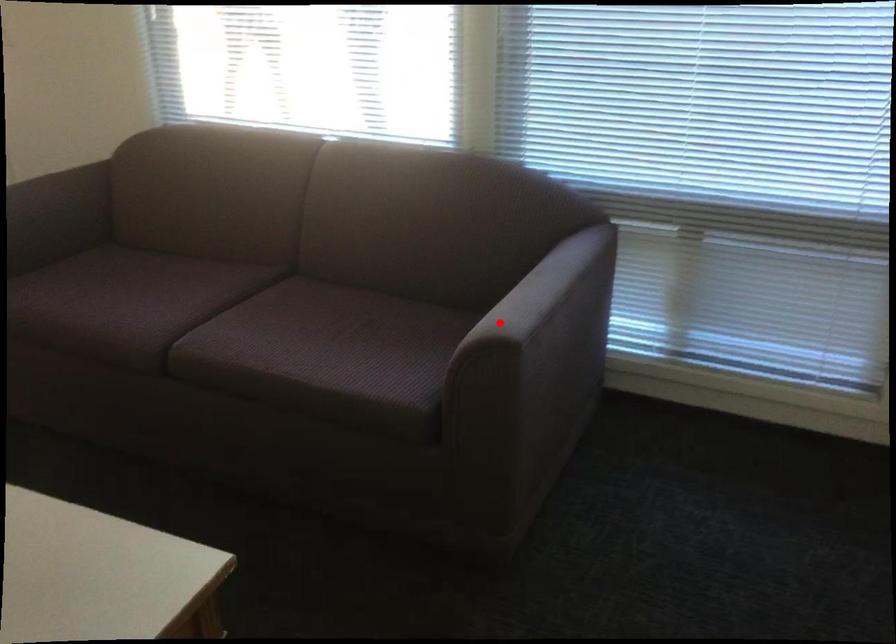
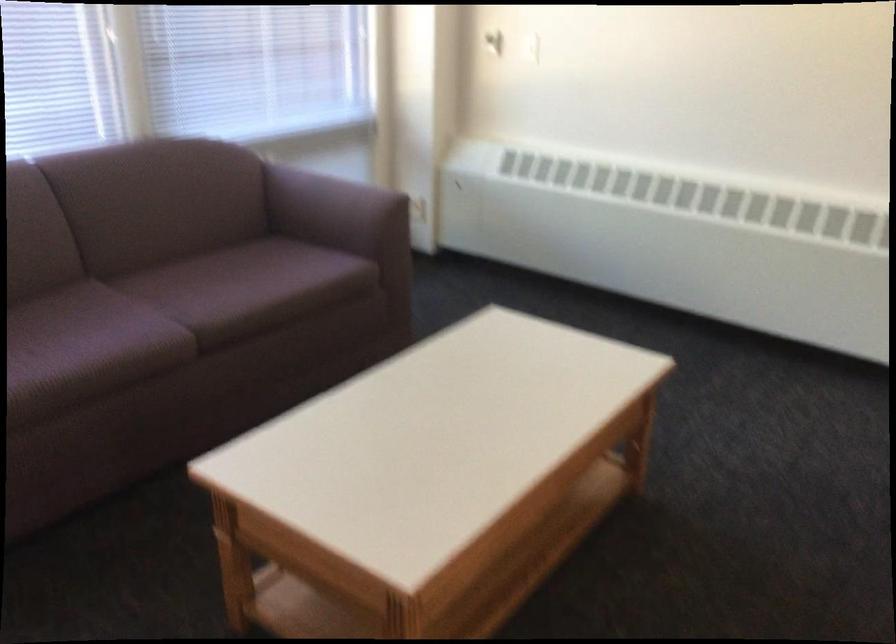
The point at the highlighted location is marked in the first image. Where is the corresponding point in the second image?

(336, 211)